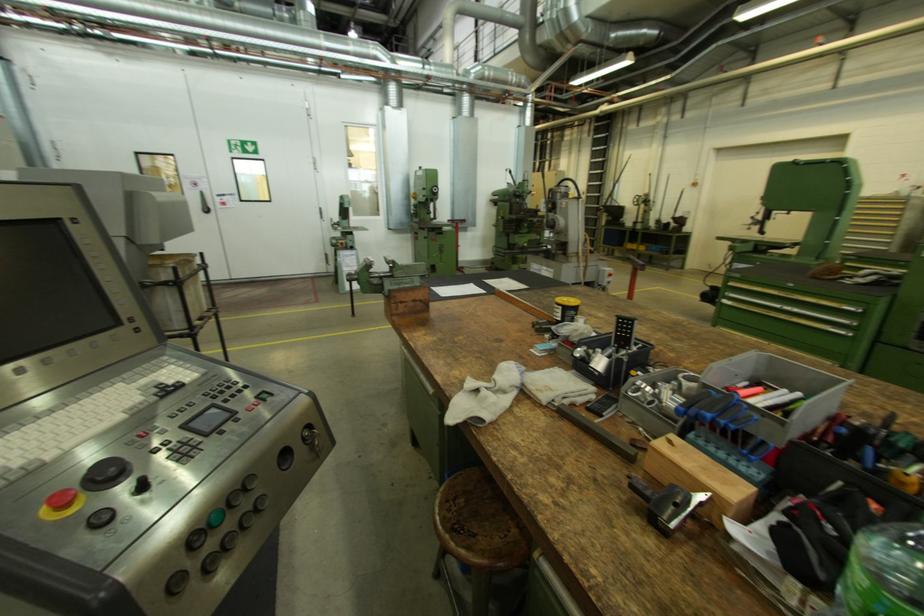
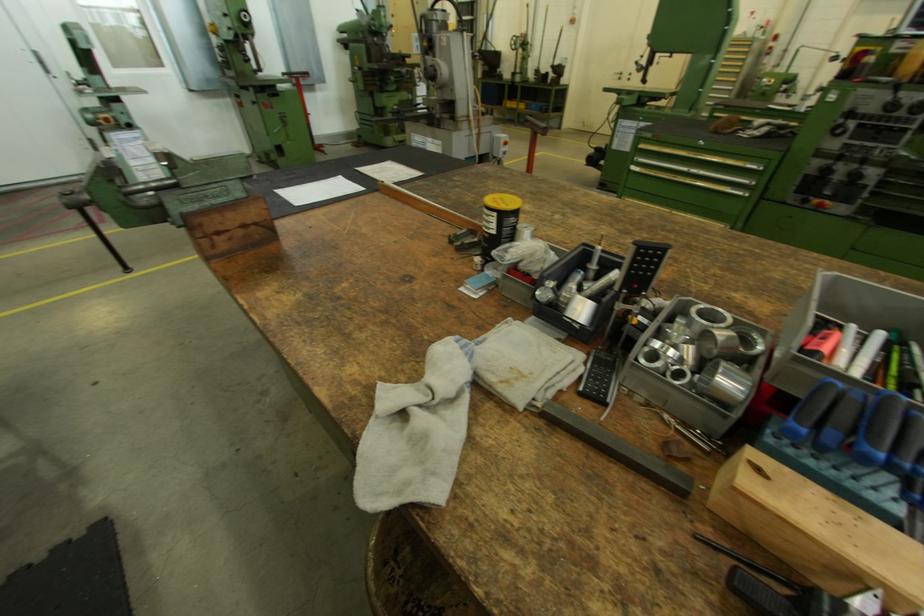
The point at (599, 398) is marked in the first image. Where is the corresponding point in the second image?

(589, 370)